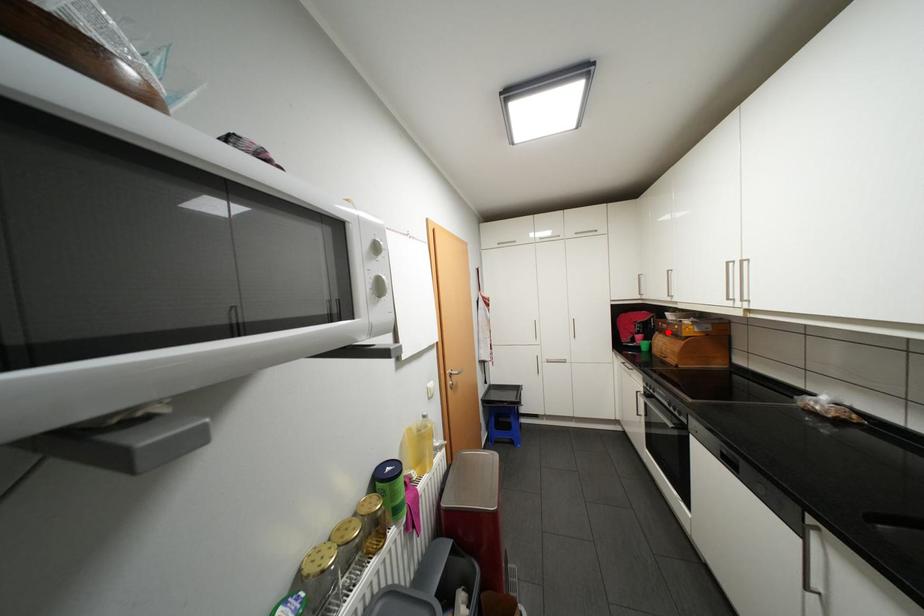
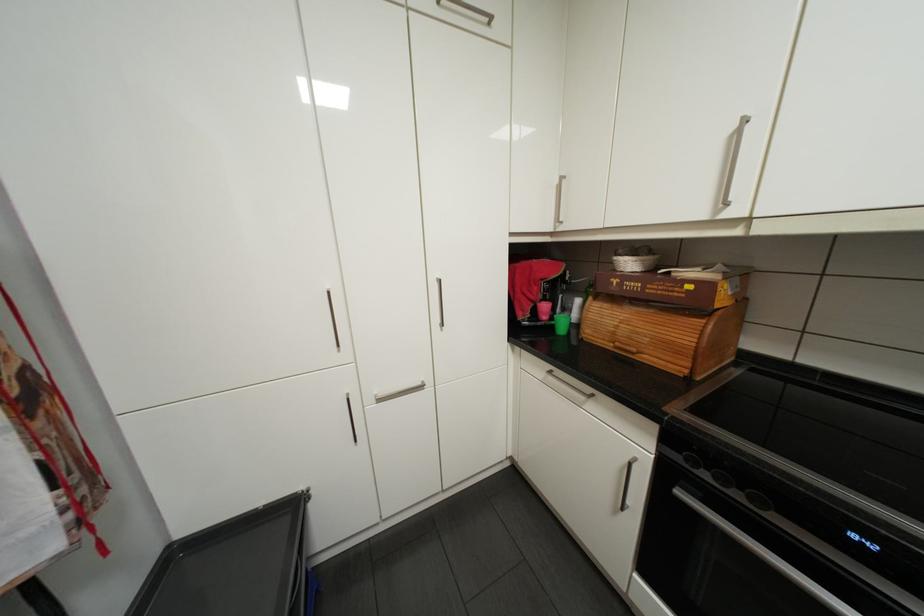
The point at the highlighted location is marked in the first image. Where is the corresponding point in the second image?

(602, 297)